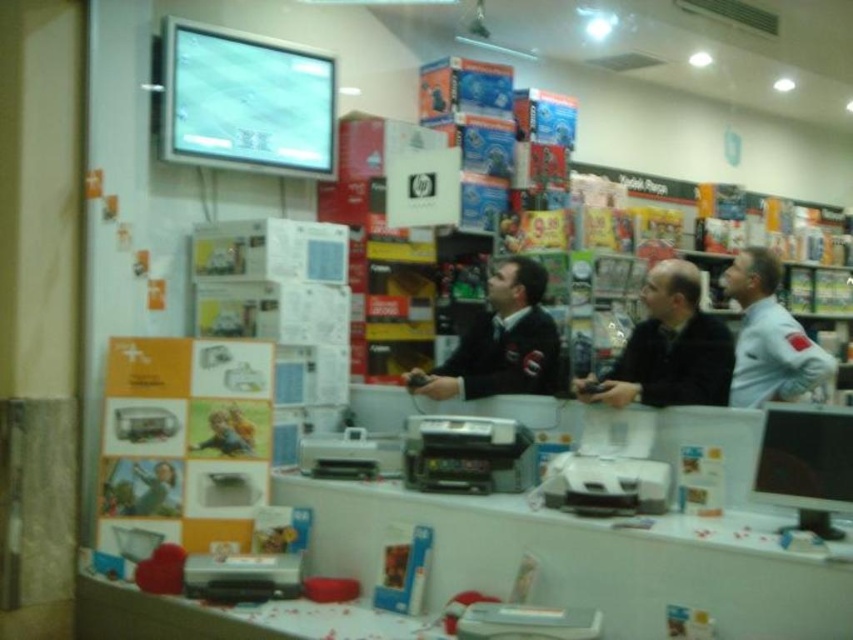
In the scene shown: You are a customer standing in the store and want to touch both the orange matte poster at left and the black matte jacket at center. Which item should you reach for first to touch the closer one?

The orange matte poster at left is closer to the viewer than the black matte jacket at center, so you should reach for the orange matte poster at left first.

You are a store employee who needs to place a black matte shirt at center and a black matte jacket at center on a shelf. Which item should you place first if you want to maximize shelf space efficiency?

The black matte shirt at center has a larger size compared to the black matte jacket at center, so you should place the black matte shirt at center first to utilize the larger space first and optimize shelf arrangement.

You are a customer in the store and want to pick up both the black matte shirt at center and the black matte jacket at center. Which item should you grab first if you want to start with the one on the left?

The black matte jacket at center is on the left side of the black matte shirt at center, so you should grab the black matte jacket at center first.